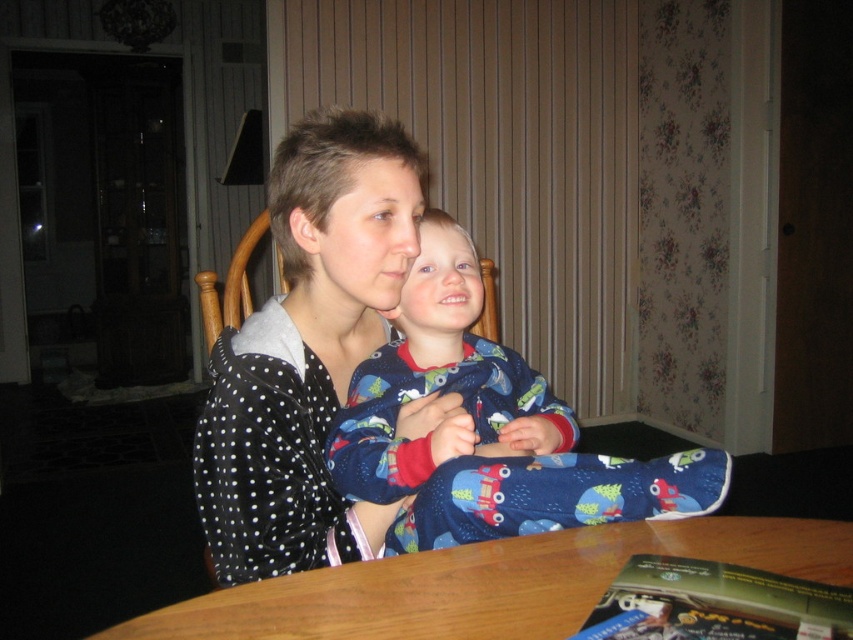
You are an interior designer planning to place a decorative pillow on the table where the polka dot fabric at center and blue cotton pajamas at center are located. Considering their sizes, which object would you choose to place the pillow next to to ensure it doesn

The polka dot fabric at center has a smaller width compared to the blue cotton pajamas at center. Therefore, placing the decorative pillow next to the blue cotton pajamas at center would provide more space for the pillow to fit comfortably.

You are planning to place a rectangular book on the wooden table at center. The book has a width equal to the blue cotton pajamas at center. Will the book fit on the table without overhanging the edges?

The blue cotton pajamas at center has a lesser width compared to wooden table at center, so the book with the same width as the blue cotton pajamas at center will fit on the wooden table at center without overhanging the edges.